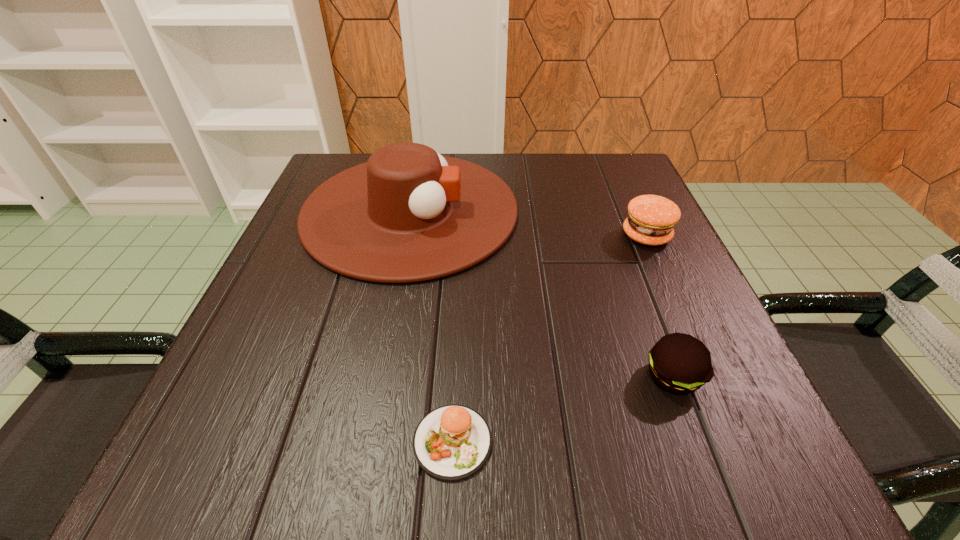
Select which object appears as the third closest to the farthest patty. Please provide its 2D coordinates. Your answer should be formatted as a tuple, i.e. [(x, y)], where the tuple contains the x and y coordinates of a point satisfying the conditions above.

[(452, 442)]

Where is `patty that is the second closest to the shortest patty`? patty that is the second closest to the shortest patty is located at coordinates (651, 219).

Identify which patty is located as the second nearest to the leftmost patty. Please provide its 2D coordinates. Your answer should be formatted as a tuple, i.e. [(x, y)], where the tuple contains the x and y coordinates of a point satisfying the conditions above.

[(651, 219)]

Image resolution: width=960 pixels, height=540 pixels. Find the location of `vacant space that satisfies the following two spatial constraints: 1. on the front-facing side of the cowboy hat; 2. on the back side of the farthest patty`. vacant space that satisfies the following two spatial constraints: 1. on the front-facing side of the cowboy hat; 2. on the back side of the farthest patty is located at coordinates (405, 235).

Identify the location of vacant region that satisfies the following two spatial constraints: 1. on the front-facing side of the tallest object; 2. on the right side of the second farthest patty. (376, 376).

Image resolution: width=960 pixels, height=540 pixels. I want to click on vacant space that satisfies the following two spatial constraints: 1. on the front-facing side of the tallest object; 2. on the left side of the nearest object, so click(x=364, y=442).

Find the location of `vacant region that satisfies the following two spatial constraints: 1. on the back side of the second nearest object; 2. on the front-facing side of the cowboy hat`. vacant region that satisfies the following two spatial constraints: 1. on the back side of the second nearest object; 2. on the front-facing side of the cowboy hat is located at coordinates (611, 211).

Image resolution: width=960 pixels, height=540 pixels. I want to click on vacant space that satisfies the following two spatial constraints: 1. on the back side of the farthest patty; 2. on the right side of the second nearest object, so click(619, 235).

Locate an element on the screen. The height and width of the screenshot is (540, 960). free space that satisfies the following two spatial constraints: 1. on the back side of the farthest patty; 2. on the left side of the shortest object is located at coordinates point(463,235).

Locate an element on the screen. The height and width of the screenshot is (540, 960). vacant space that satisfies the following two spatial constraints: 1. on the front-facing side of the cowboy hat; 2. on the left side of the farthest patty is located at coordinates (405, 235).